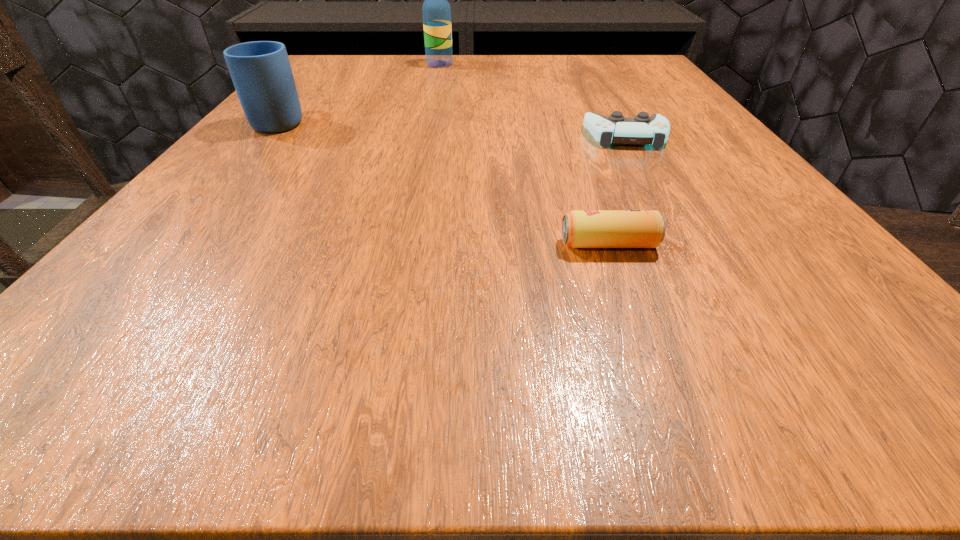
Where is `the farthest object`? The width and height of the screenshot is (960, 540). the farthest object is located at coordinates (436, 11).

You are a GUI agent. You are given a task and a screenshot of the screen. Output one action in this format:
    pyautogui.click(x=<x>, y=<y>)
    Task: Click on the tallest object
    The width and height of the screenshot is (960, 540).
    Given the screenshot: What is the action you would take?
    pyautogui.click(x=436, y=11)

The image size is (960, 540). Find the location of `the third shortest object`. the third shortest object is located at coordinates (261, 72).

At what (x,y) coordinates should I click in order to perform the action: click on mug. Please return your answer as a coordinate pair (x, y). The width and height of the screenshot is (960, 540). Looking at the image, I should click on (261, 72).

Image resolution: width=960 pixels, height=540 pixels. Find the location of `the nearest object`. the nearest object is located at coordinates (580, 228).

Identify the location of control. The image size is (960, 540). (642, 130).

What are the coordinates of `vacant area located 0.180m on the front label of the second object from left to right` in the screenshot? It's located at tap(526, 64).

Find the location of a particular element. The height and width of the screenshot is (540, 960). free space located on the side of the mug with the handle is located at coordinates (316, 78).

Where is `free space located on the side of the mug with the handle`? free space located on the side of the mug with the handle is located at coordinates (328, 63).

At what (x,y) coordinates should I click in order to perform the action: click on free space located on the side of the mug with the handle. Please return your answer as a coordinate pair (x, y). Image resolution: width=960 pixels, height=540 pixels. Looking at the image, I should click on (308, 87).